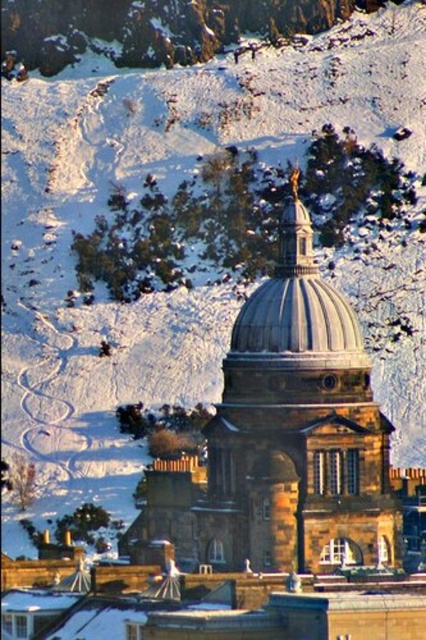
You are an architect reviewing a design blueprint. The blueprint shows two domes on the building facade. The smooth stone dome at center and the shiny silver dome at center. Which one has a bigger size?

The smooth stone dome at center has a larger size compared to the shiny silver dome at center.

In the scene shown: You are an architect analyzing the building in the snowy landscape. You notice two domes at the center of the structure. Which one is closer to you, the smooth stone dome at center or the shiny silver dome at center?

The smooth stone dome at center is closer to you because it is positioned in front of the shiny silver dome at center.